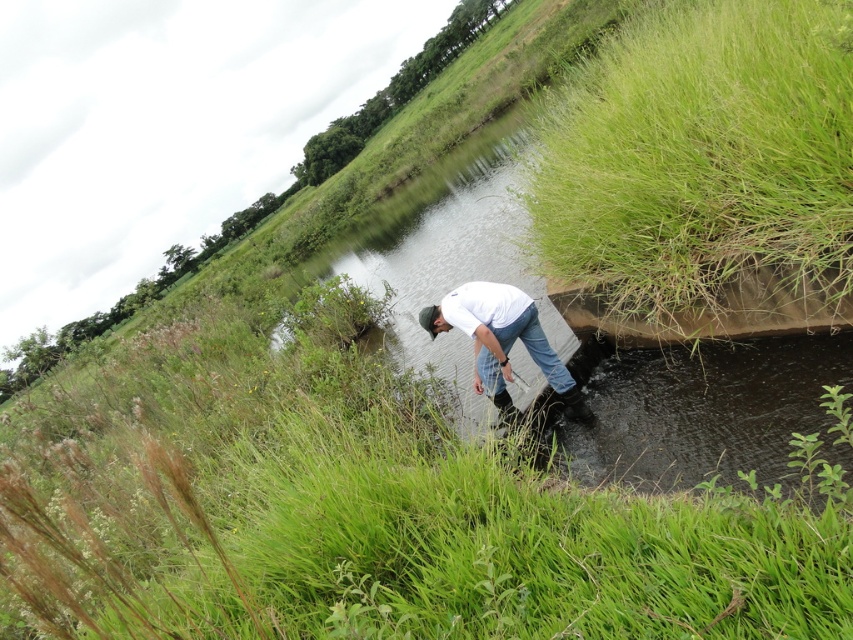
Question: Which of these objects is positioned farthest from the blue denim jeans at lower center?

Choices:
 (A) white matte shirt at center
 (B) green grassy bank at upper right

Answer: (B)

Question: Considering the relative positions of green grassy bank at upper right and white matte shirt at center in the image provided, where is green grassy bank at upper right located with respect to white matte shirt at center?

Choices:
 (A) left
 (B) right

Answer: (B)

Question: Which point is farther from the camera taking this photo?

Choices:
 (A) (714, 99)
 (B) (490, 353)

Answer: (B)

Question: Based on their relative distances, which object is nearer to the blue denim jeans at lower center?

Choices:
 (A) green grassy bank at upper right
 (B) white matte shirt at center

Answer: (B)

Question: Does green grassy bank at upper right appear over white matte shirt at center?

Choices:
 (A) no
 (B) yes

Answer: (B)

Question: Is green grassy bank at upper right bigger than white matte shirt at center?

Choices:
 (A) no
 (B) yes

Answer: (B)